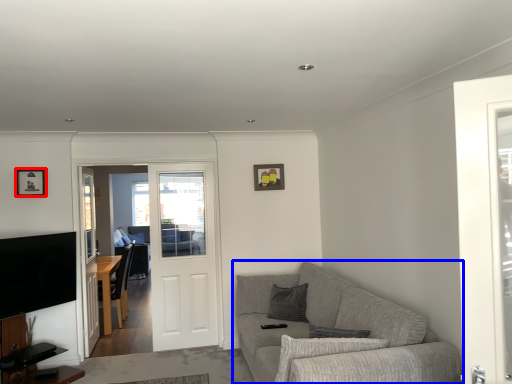
Question: Which of the following is the farthest to the observer, picture frame (highlighted by a red box) or studio couch (highlighted by a blue box)?

Choices:
 (A) picture frame
 (B) studio couch

Answer: (A)